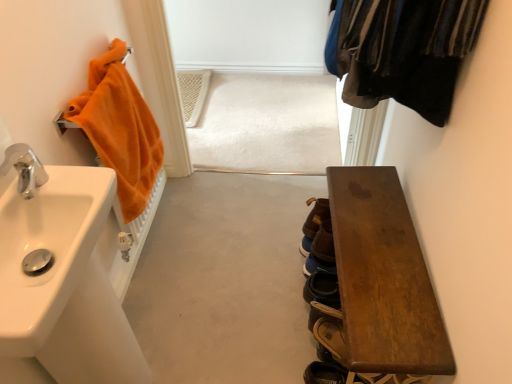
Identify the location of blank area beneath orange terry cloth towel at left (from a real-world perspective). (159, 238).